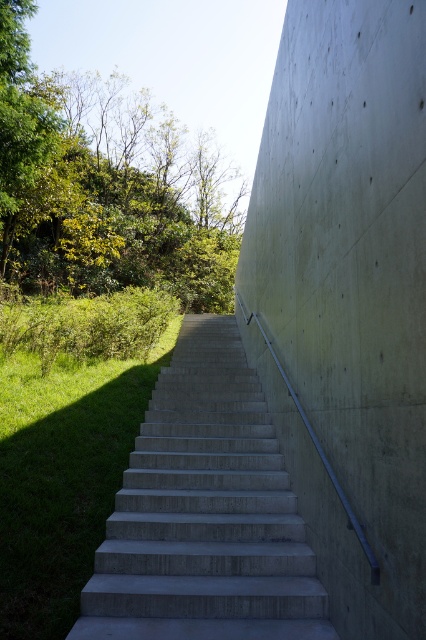
Question: Considering the relative positions of smooth concrete stairs at center and concrete stairs at center in the image provided, where is smooth concrete stairs at center located with respect to concrete stairs at center?

Choices:
 (A) below
 (B) above

Answer: (B)

Question: Which point appears closest to the camera in this image?

Choices:
 (A) (103, 497)
 (B) (129, 225)
 (C) (268, 406)

Answer: (A)

Question: Which of these objects is positioned closest to the green leafy tree at upper left?

Choices:
 (A) concrete stairs at center
 (B) green grass at lower left

Answer: (B)

Question: From the image, what is the correct spatial relationship of green leafy tree at upper left in relation to green grass at lower left?

Choices:
 (A) right
 (B) left

Answer: (B)

Question: Which of the following is the farthest from the observer?

Choices:
 (A) green leafy tree at upper left
 (B) green grass at lower left
 (C) concrete stairs at center

Answer: (A)

Question: Is concrete stairs at center further to the viewer compared to green leafy tree at upper left?

Choices:
 (A) yes
 (B) no

Answer: (B)